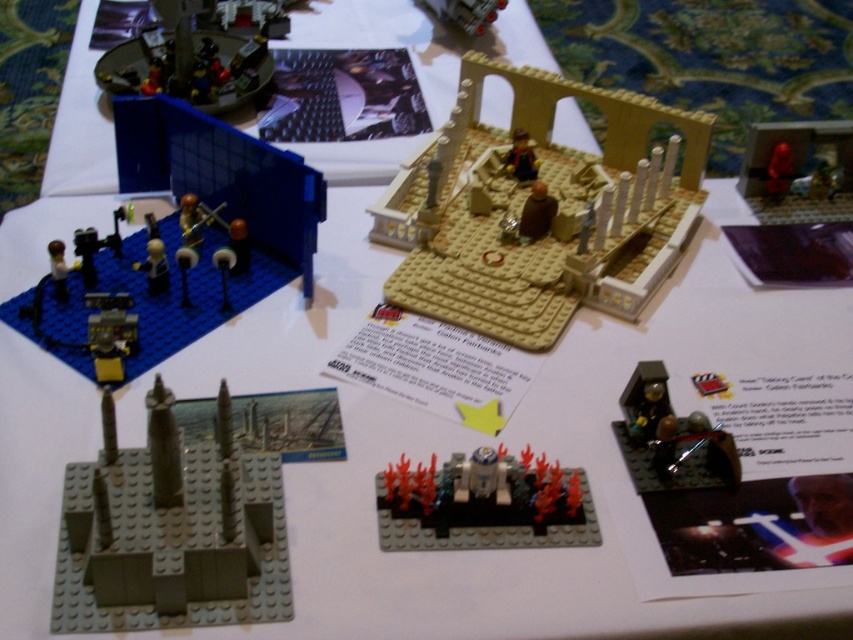
Is dark gray plastic building at lower left smaller than shiny red figure at upper right?

Yes.

Who is lower down, dark gray plastic building at lower left or shiny red figure at upper right?

dark gray plastic building at lower left

Between point (169, 592) and point (747, 129), which one is positioned in front?

Point (169, 592) is in front.

This screenshot has height=640, width=853. I want to click on dark gray plastic building at lower left, so click(x=170, y=531).

Which of these two, dark gray plastic building at lower left or metallic silver minifigure at lower right, stands shorter?

With less height is metallic silver minifigure at lower right.

Does dark gray plastic building at lower left have a greater height compared to metallic silver minifigure at lower right?

Yes.

The height and width of the screenshot is (640, 853). In order to click on dark gray plastic building at lower left in this screenshot , I will do `click(170, 531)`.

Does dark gray plastic building at lower left have a greater width compared to metallic silver spaceship at upper center?

Yes, dark gray plastic building at lower left is wider than metallic silver spaceship at upper center.

Can you confirm if dark gray plastic building at lower left is thinner than metallic silver spaceship at upper center?

Incorrect, dark gray plastic building at lower left's width is not less than metallic silver spaceship at upper center's.

What do you see at coordinates (170, 531) in the screenshot?
I see `dark gray plastic building at lower left` at bounding box center [170, 531].

Identify the location of dark gray plastic building at lower left. Image resolution: width=853 pixels, height=640 pixels. (170, 531).